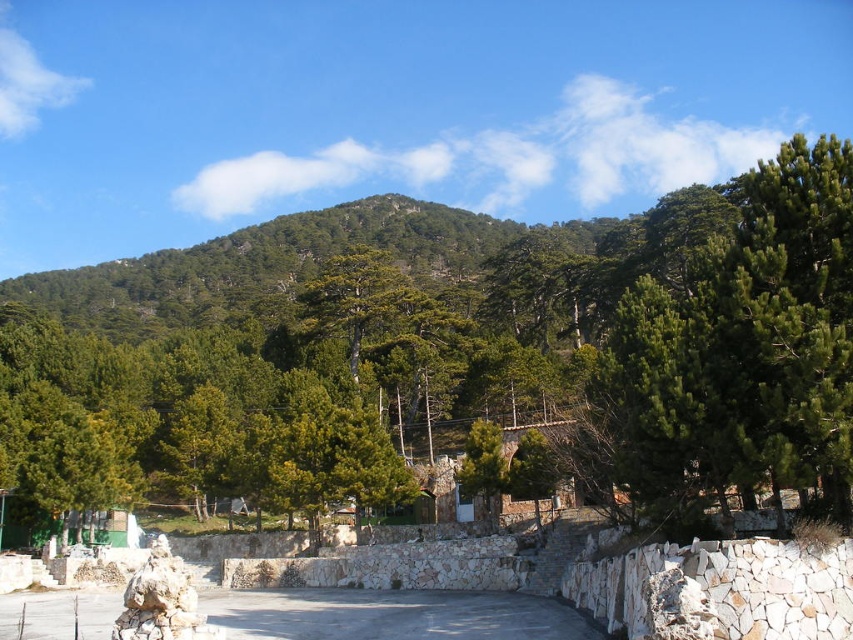
Which is above, green textured tree at center or green needle-like tree at upper right?

Positioned higher is green textured tree at center.

From the picture: Who is lower down, green textured tree at center or green needle-like tree at upper right?

green needle-like tree at upper right is lower down.

Who is more distant from viewer, (447, 408) or (686, 218)?

Point (447, 408)

You are a GUI agent. You are given a task and a screenshot of the screen. Output one action in this format:
    pyautogui.click(x=<x>, y=<y>)
    Task: Click on the green textured tree at center
    
    Given the screenshot: What is the action you would take?
    pyautogui.click(x=463, y=356)